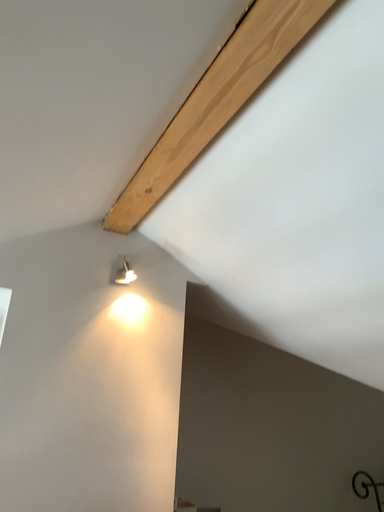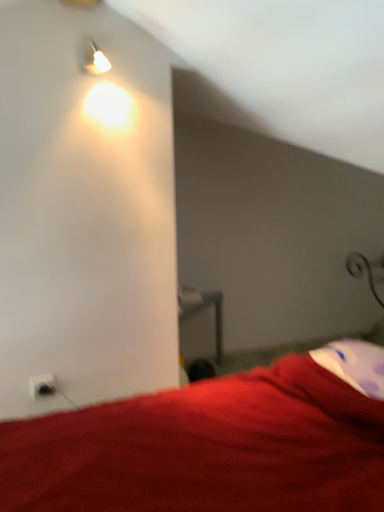
Question: Which way did the camera rotate in the video?

Choices:
 (A) rotated downward
 (B) rotated upward

Answer: (A)